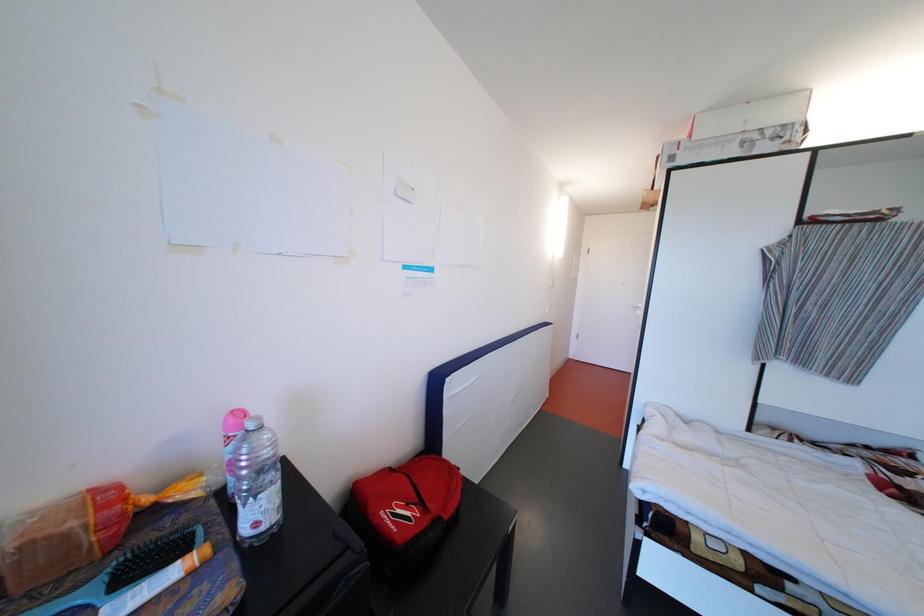
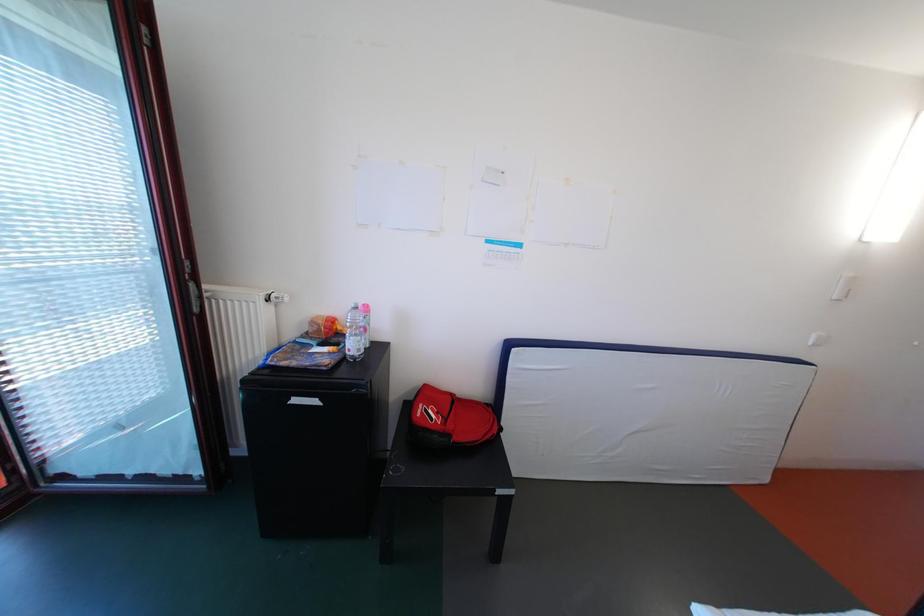
Question: The first image is from the beginning of the video and the second image is from the end. How did the camera likely rotate when shooting the video?

Choices:
 (A) Left
 (B) Right
 (C) Up
 (D) Down

Answer: (A)